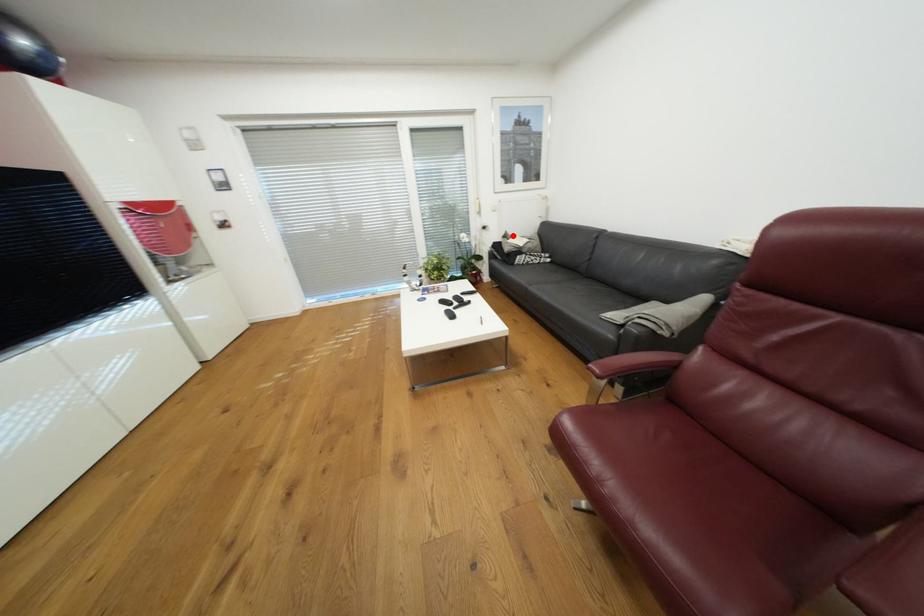
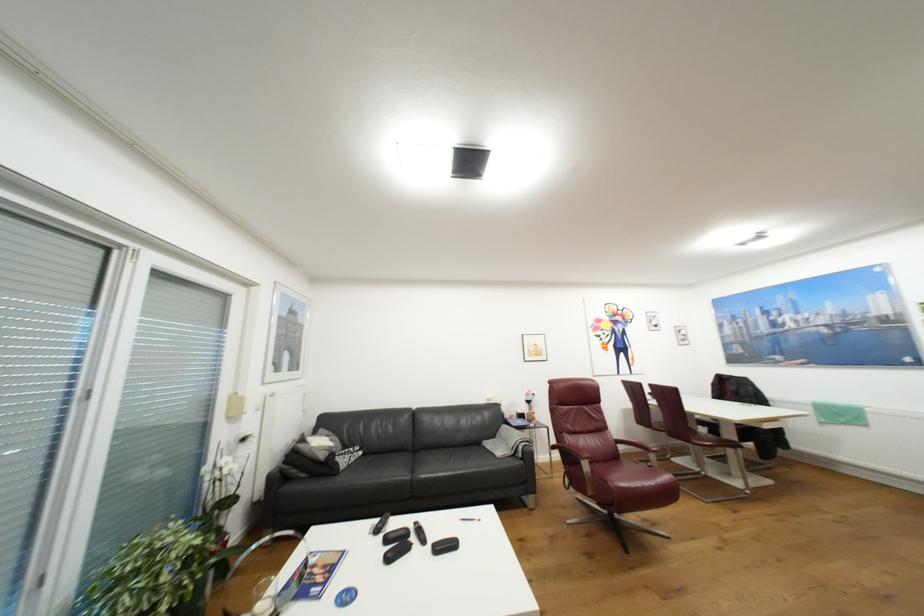
In the second image, find the point that corresponds to the highlighted location in the first image.

(309, 440)